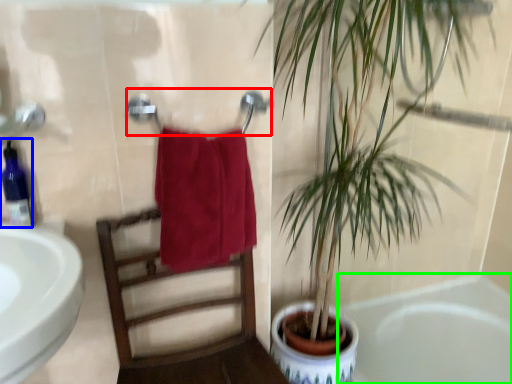
Question: Estimate the real-world distances between objects in this image. Which object is farther from towel bar (highlighted by a red box), soap dispenser (highlighted by a blue box) or bathtub (highlighted by a green box)?

Choices:
 (A) soap dispenser
 (B) bathtub

Answer: (B)